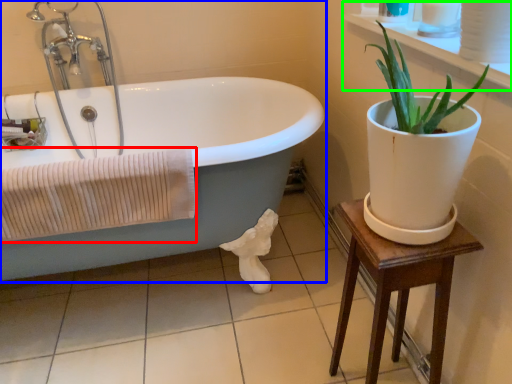
Question: Based on their relative distances, which object is farther from bath towel (highlighted by a red box)? Choose from bathtub (highlighted by a blue box) and window sill (highlighted by a green box).

Choices:
 (A) bathtub
 (B) window sill

Answer: (B)